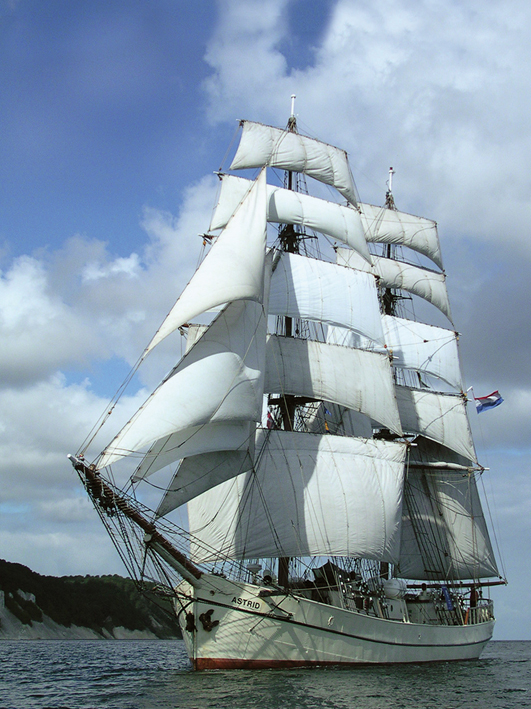
The height and width of the screenshot is (709, 531). I want to click on wires, so click(x=145, y=579), click(x=198, y=539), click(x=235, y=566).